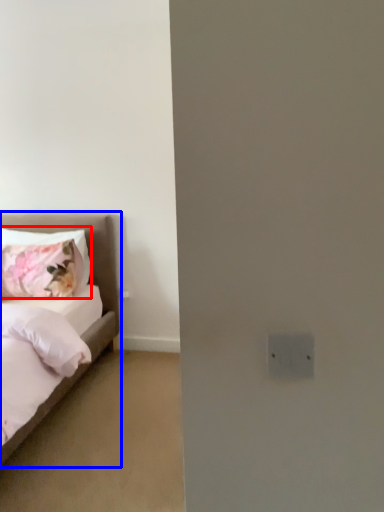
Question: Which object appears farthest to the camera in this image, pillow (highlighted by a red box) or bed (highlighted by a blue box)?

Choices:
 (A) pillow
 (B) bed

Answer: (A)